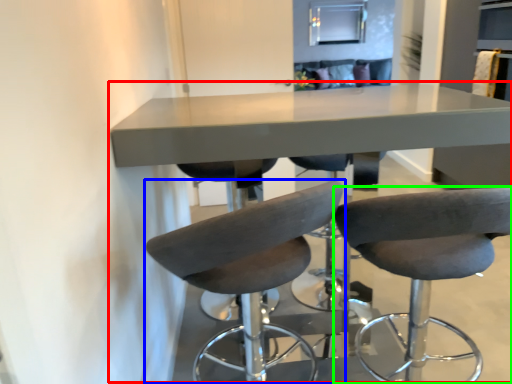
Question: Which is farther away from table (highlighted by a red box)? chair (highlighted by a blue box) or chair (highlighted by a green box)?

Choices:
 (A) chair
 (B) chair

Answer: (B)